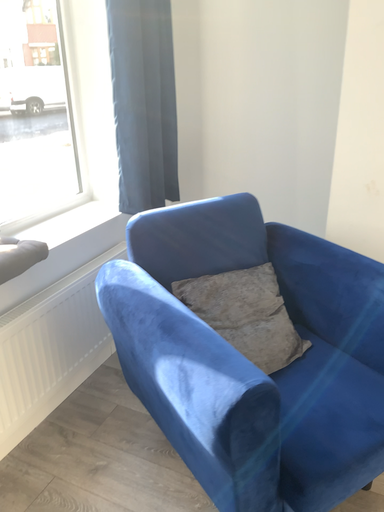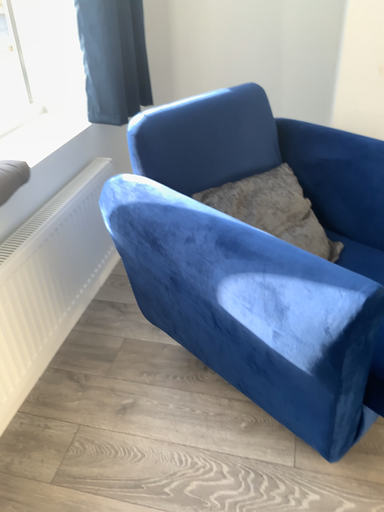
Question: How did the camera likely rotate when shooting the video?

Choices:
 (A) rotated right
 (B) rotated left

Answer: (A)